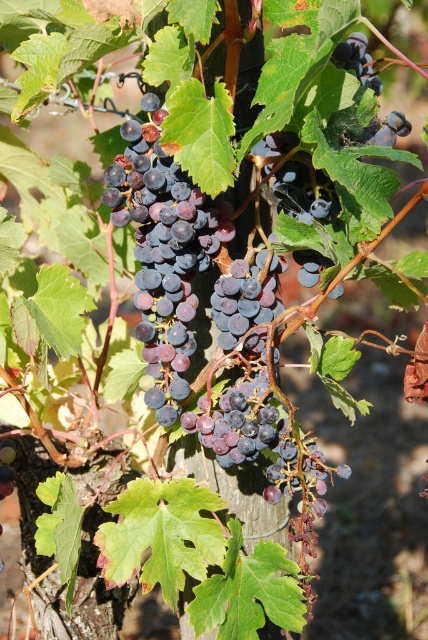
Question: Is dark purple grapes at center thinner than shiny purple grapes at center?

Choices:
 (A) no
 (B) yes

Answer: (A)

Question: Can you confirm if dark purple grapes at center is bigger than shiny purple grapes at center?

Choices:
 (A) no
 (B) yes

Answer: (B)

Question: Which of the following is the closest to the observer?

Choices:
 (A) dark purple grapes at center
 (B) shiny purple grapes at center

Answer: (A)

Question: Which point is farther from the camera taking this photo?

Choices:
 (A) (11, 490)
 (B) (160, 280)

Answer: (A)

Question: Can you confirm if dark purple grapes at center is positioned to the right of shiny purple grapes at center?

Choices:
 (A) yes
 (B) no

Answer: (A)